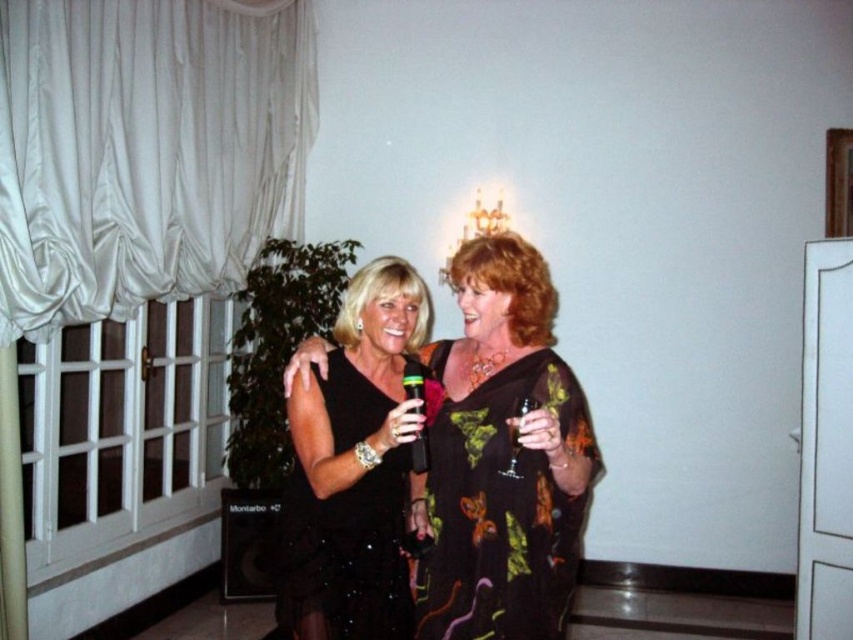
Question: Is translucent plastic wine glass at center behind clear glass wine glass at center?

Choices:
 (A) no
 (B) yes

Answer: (B)

Question: Which point is closer to the camera taking this photo?

Choices:
 (A) (418, 387)
 (B) (509, 460)

Answer: (B)

Question: Observing the image, what is the correct spatial positioning of floral print fabric dress at center in reference to translucent plastic wine glass at center?

Choices:
 (A) below
 (B) above

Answer: (A)

Question: Observing the image, what is the correct spatial positioning of floral print fabric dress at center in reference to translucent plastic wine glass at center?

Choices:
 (A) above
 (B) below

Answer: (B)

Question: Which of these objects is positioned closest to the black satin dress at center?

Choices:
 (A) floral print fabric dress at center
 (B) translucent plastic wine glass at center
 (C) black sequined dress at center

Answer: (A)

Question: Estimate the real-world distances between objects in this image. Which object is closer to the translucent plastic wine glass at center?

Choices:
 (A) black sequined dress at center
 (B) clear glass wine glass at center
 (C) black satin dress at center
 (D) floral print fabric dress at center

Answer: (B)